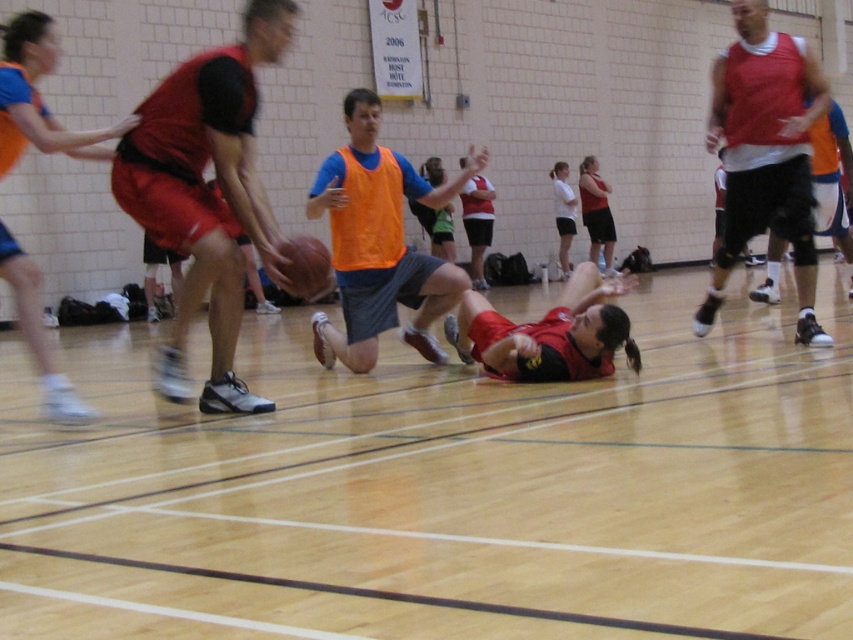
Question: Which point is farther from the camera taking this photo?

Choices:
 (A) (550, 88)
 (B) (341, 358)

Answer: (A)

Question: Can you confirm if matte red shorts at left is positioned above orange fabric shirt at center?

Choices:
 (A) yes
 (B) no

Answer: (A)

Question: Estimate the real-world distances between objects in this image. Which object is closer to the rubber/leather basketball at center?

Choices:
 (A) orange fabric shirt at center
 (B) matte black shorts at left
 (C) wooden floor at center

Answer: (A)

Question: Among these objects, which one is nearest to the camera?

Choices:
 (A) matte black shorts at center
 (B) matte red tank top at right
 (C) matte red shorts at center

Answer: (C)

Question: Does matte black shorts at left appear under rubber/leather basketball at center?

Choices:
 (A) yes
 (B) no

Answer: (B)

Question: In this image, where is matte red shorts at left located relative to matte red tank top at right?

Choices:
 (A) below
 (B) above

Answer: (A)